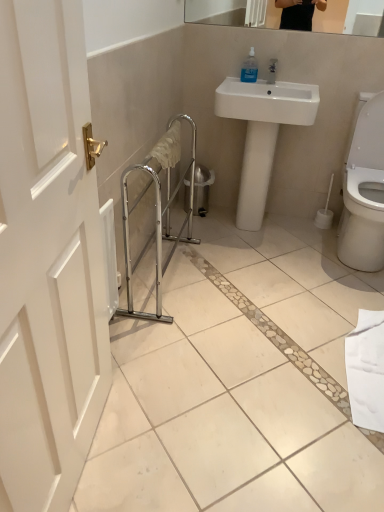
Question: Can you confirm if transparent plastic soap dispenser at upper center is thinner than chrome metallic balustrade at center?

Choices:
 (A) yes
 (B) no

Answer: (A)

Question: Does transparent plastic soap dispenser at upper center appear on the right side of chrome metallic balustrade at center?

Choices:
 (A) no
 (B) yes

Answer: (B)

Question: From the image's perspective, is transparent plastic soap dispenser at upper center on top of chrome metallic balustrade at center?

Choices:
 (A) no
 (B) yes

Answer: (B)

Question: Considering the relative sizes of transparent plastic soap dispenser at upper center and chrome metallic balustrade at center in the image provided, is transparent plastic soap dispenser at upper center bigger than chrome metallic balustrade at center?

Choices:
 (A) yes
 (B) no

Answer: (B)

Question: Can you confirm if transparent plastic soap dispenser at upper center is smaller than chrome metallic balustrade at center?

Choices:
 (A) yes
 (B) no

Answer: (A)

Question: Does transparent plastic soap dispenser at upper center have a greater width compared to chrome metallic balustrade at center?

Choices:
 (A) no
 (B) yes

Answer: (A)

Question: Does white glossy sink at center have a lesser height compared to chrome metallic balustrade at center?

Choices:
 (A) no
 (B) yes

Answer: (A)

Question: From the image's perspective, is white glossy sink at center under chrome metallic balustrade at center?

Choices:
 (A) yes
 (B) no

Answer: (B)

Question: Is the position of white glossy sink at center less distant than that of chrome metallic balustrade at center?

Choices:
 (A) no
 (B) yes

Answer: (A)

Question: From a real-world perspective, is white glossy sink at center located beneath chrome metallic balustrade at center?

Choices:
 (A) yes
 (B) no

Answer: (B)

Question: Does white glossy sink at center come behind chrome metallic balustrade at center?

Choices:
 (A) yes
 (B) no

Answer: (A)

Question: Does white glossy sink at center contain chrome metallic balustrade at center?

Choices:
 (A) yes
 (B) no

Answer: (B)

Question: Is the position of chrome metallic balustrade at center more distant than that of transparent plastic soap dispenser at upper center?

Choices:
 (A) no
 (B) yes

Answer: (A)